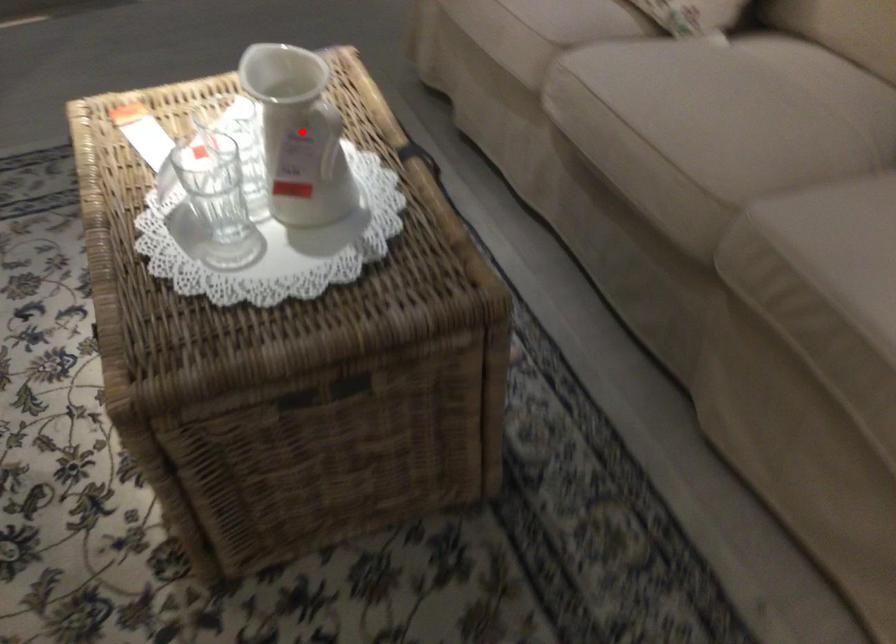
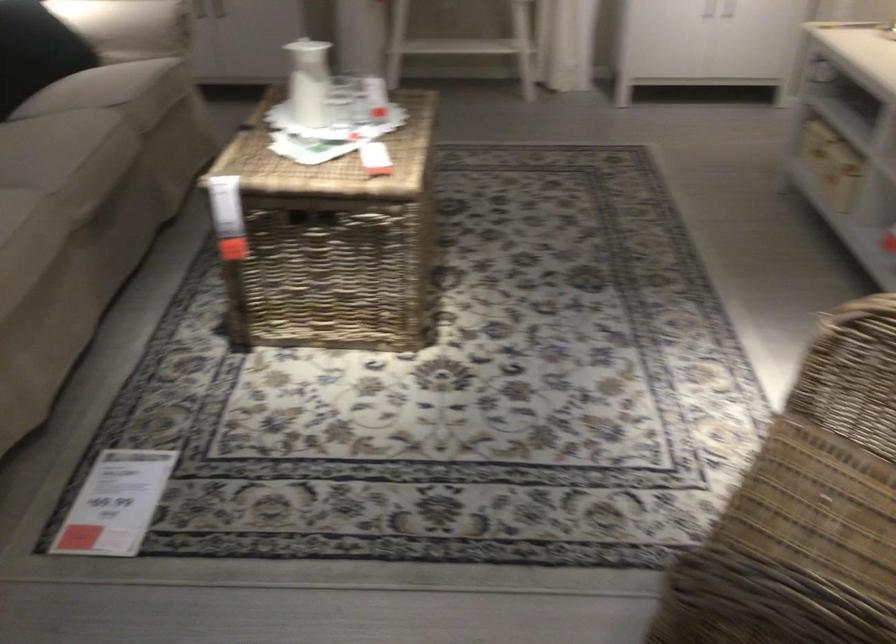
Question: A red point is marked in image1. In image2, is the corresponding 3D point closer to the camera or farther? Reply with the corresponding letter.

Choices:
 (A) The corresponding 3D point is closer.
 (B) The corresponding 3D point is farther.

Answer: (B)